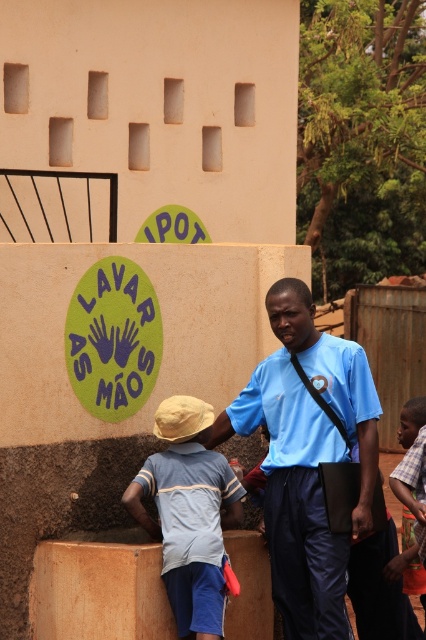
You are standing in the outdoor scene described. You need to locate the blue fabric shirt at center. Where exactly is it positioned in terms of coordinates?

The blue fabric shirt at center is located at coordinates point (307, 458).

You are standing in the outdoor scene and notice two shirts in the foreground. The blue fabric shirt at center and the plaid fabric shirt at right. Which shirt is higher up in your view?

The blue fabric shirt at center is located above the plaid fabric shirt at right, so it is higher up in your view.

Based on the scene description, where is the light blue fabric shirt at lower left located in terms of coordinates?

The light blue fabric shirt at lower left is located at coordinates point (189,513).